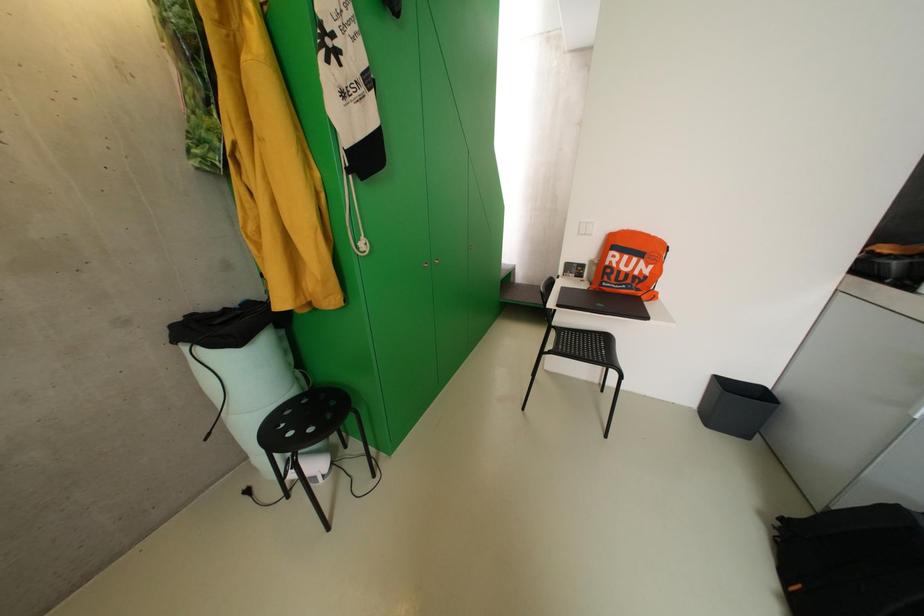
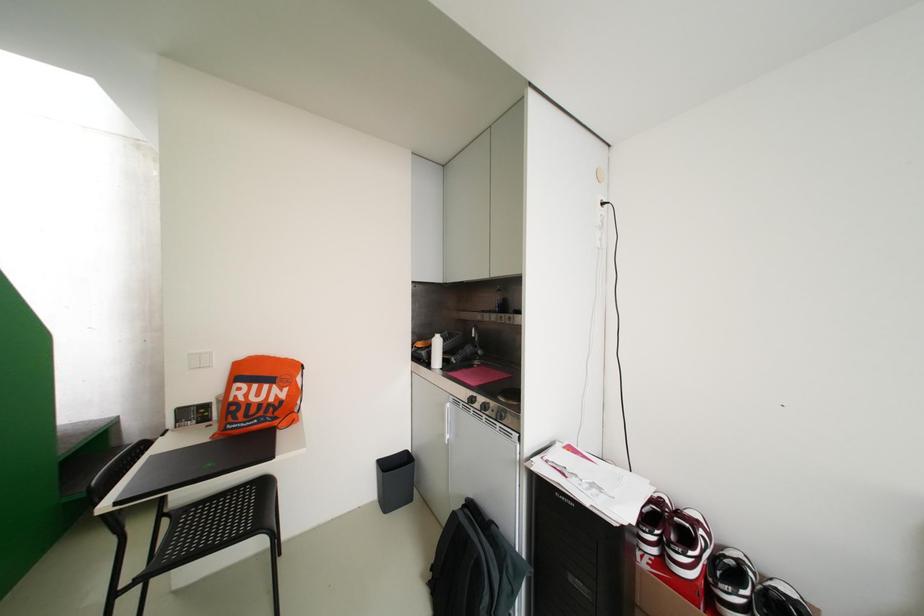
Question: How did the camera likely rotate?

Choices:
 (A) Left
 (B) Right
 (C) Up
 (D) Down

Answer: (B)